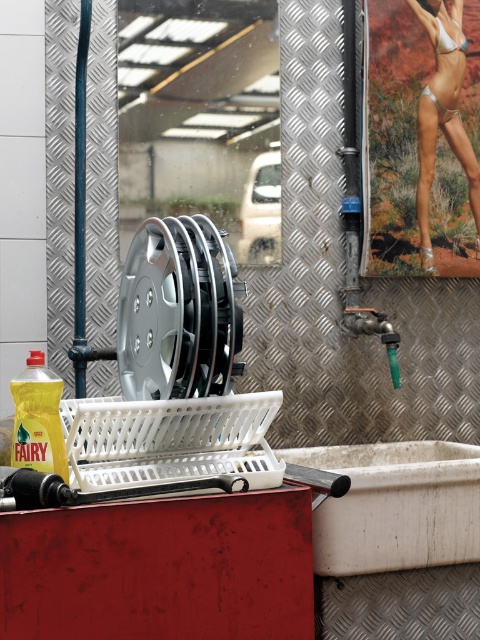
You are organizing a swimwear display in the utility area. You need to place both the silver metallic bikini at upper right and the white matte bikini top at upper right on a shelf. The shelf has a height limit of 10 cm. Can you fit both items on the shelf without exceeding the height limit?

The silver metallic bikini at upper right is closer to the viewer than the white matte bikini top at upper right. However, the height of each item is not provided in the description, so we cannot determine if they will fit within the 10 cm height limit. Additional information about their individual heights is needed.

You are organizing tools in a utility area and see the silver metallic tire at center and the green plastic faucet at center right. Which object is positioned more to the left?

The silver metallic tire at center is positioned more to the left than the green plastic faucet at center right.